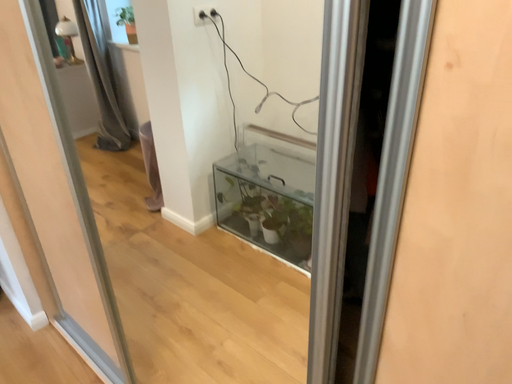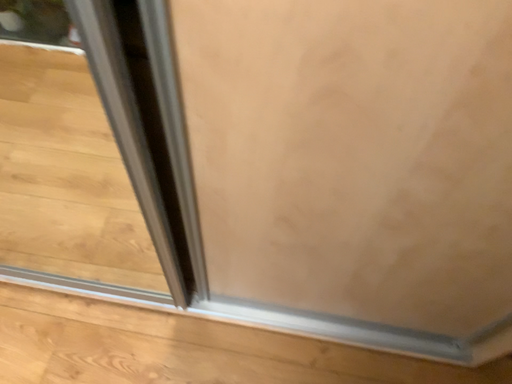
Question: How did the camera likely rotate when shooting the video?

Choices:
 (A) rotated right
 (B) rotated left

Answer: (A)